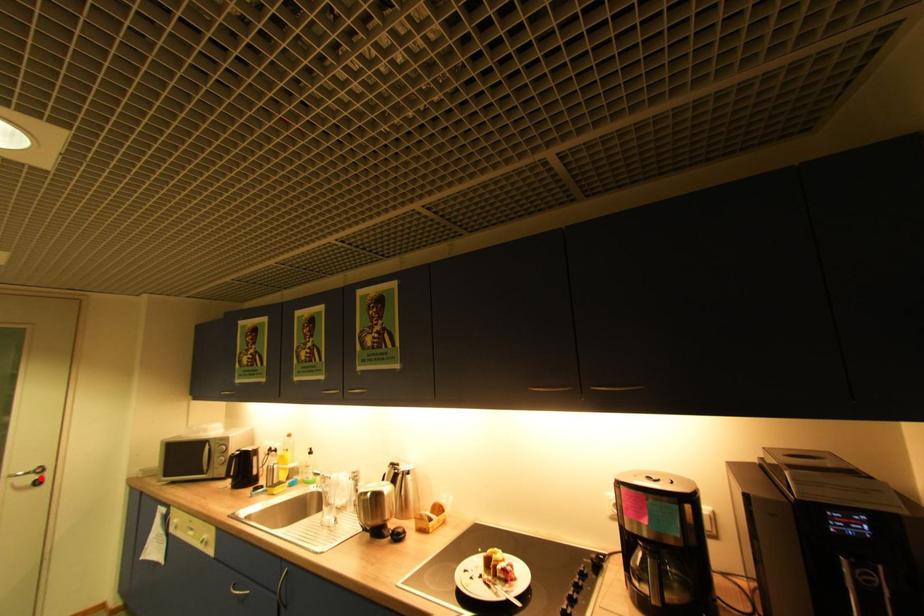
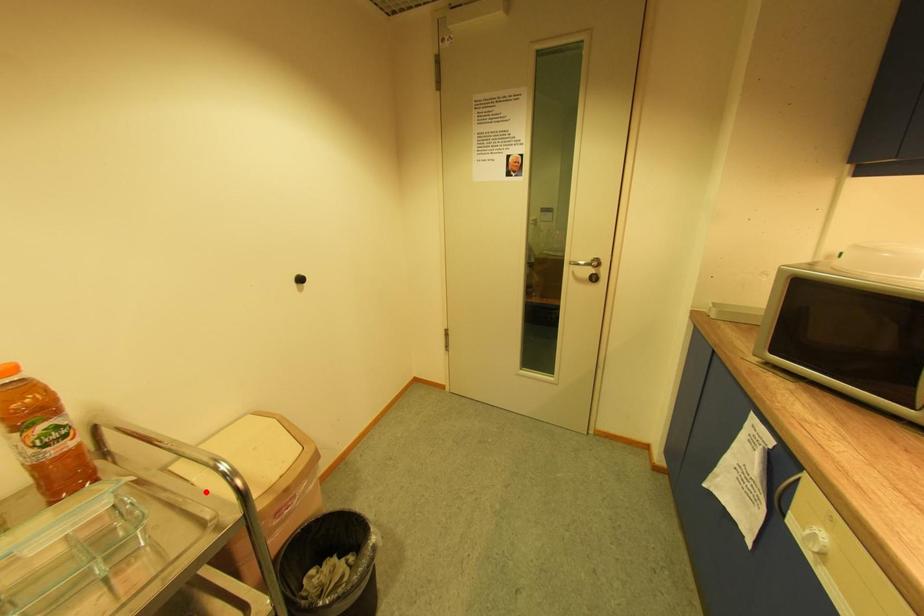
I am providing you with two images of the same scene from different viewpoints. A red point is marked on the first image and another point is marked on the second image. Are the points marked in image1 and image2 representing the same 3D position?

No